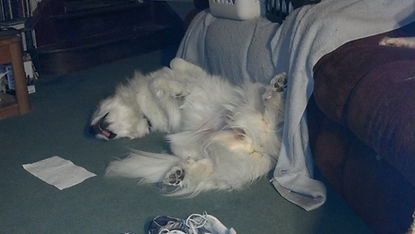
Where is `2 landry baskets`? 2 landry baskets is located at coordinates (274, 11), (240, 10).